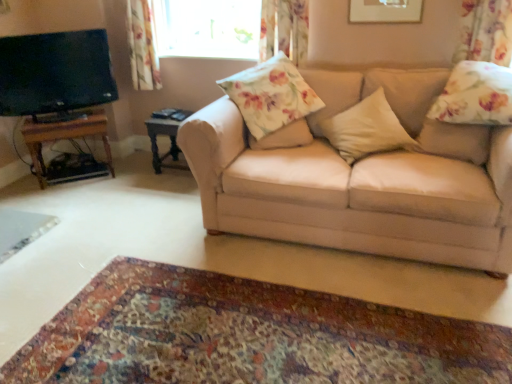
The width and height of the screenshot is (512, 384). I want to click on free space to the left of beige fabric couch at center, so click(x=122, y=220).